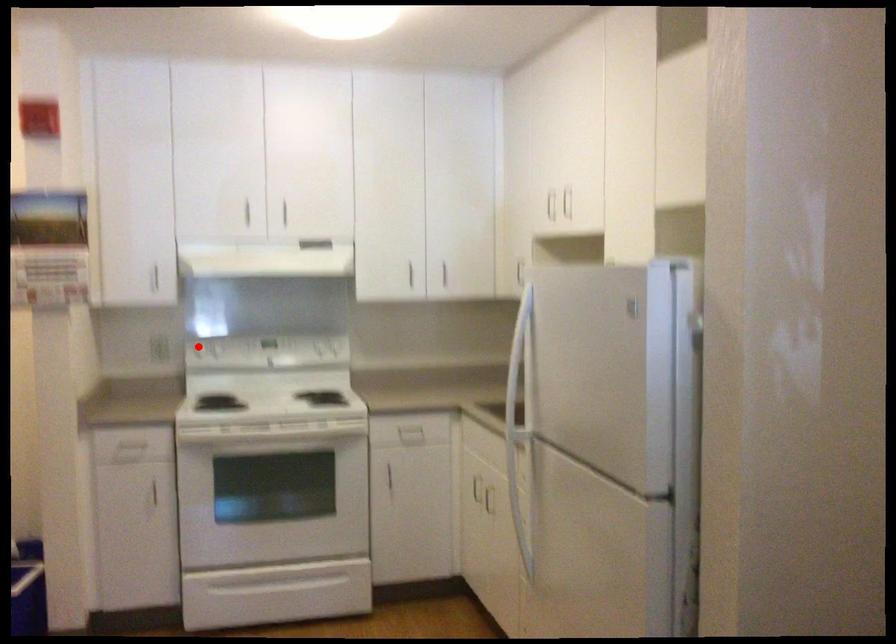
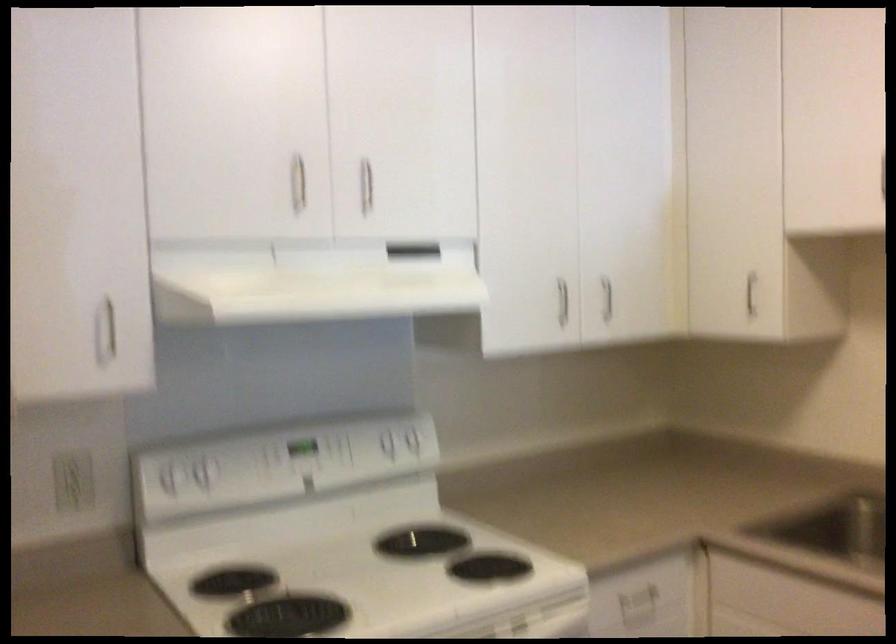
Locate, in the second image, the point that corresponds to the highlighted location in the first image.

(169, 476)